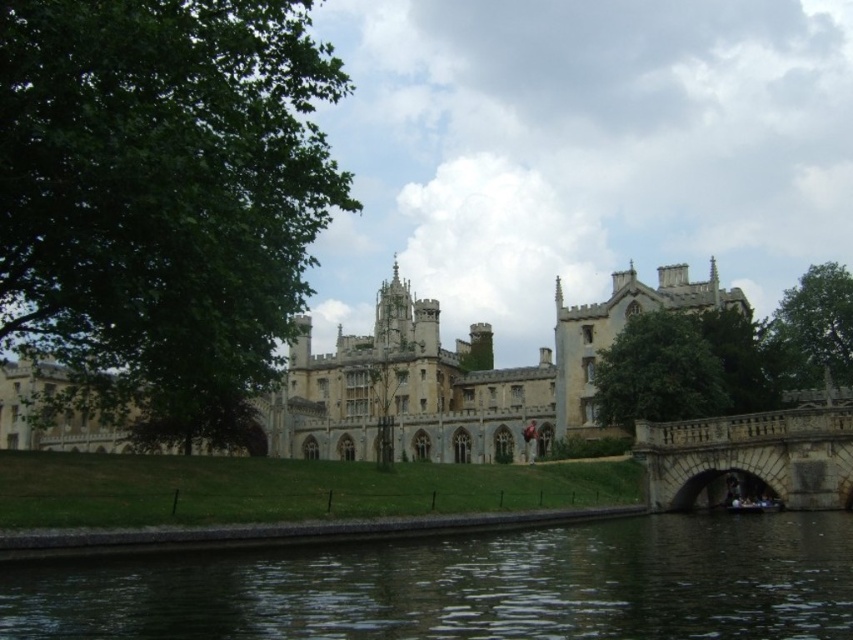
Which is above, green leafy tree at left or green leafy tree at center?

Positioned higher is green leafy tree at left.

Does green leafy tree at left appear under green leafy tree at center?

Actually, green leafy tree at left is above green leafy tree at center.

Does point (126, 51) lie in front of point (610, 408)?

Yes, it is in front of point (610, 408).

Find the location of `green leafy tree at left`. green leafy tree at left is located at coordinates (161, 184).

Between dark green water at lower center and stone castle at center, which one is positioned lower?

dark green water at lower center

Is point (366, 605) closer to viewer compared to point (502, 376)?

Yes, it is in front of point (502, 376).

Does point (796, 525) come in front of point (345, 372)?

Yes, point (796, 525) is in front of point (345, 372).

You are a GUI agent. You are given a task and a screenshot of the screen. Output one action in this format:
    pyautogui.click(x=<x>, y=<y>)
    Task: Click on the dark green water at lower center
    The height and width of the screenshot is (640, 853).
    Given the screenshot: What is the action you would take?
    pyautogui.click(x=466, y=586)

From the picture: Is stone castle at center positioned behind green leafy tree at upper right?

No, stone castle at center is closer to the viewer.

Is stone castle at center above green leafy tree at upper right?

No, stone castle at center is not above green leafy tree at upper right.

Locate an element on the screen. stone castle at center is located at coordinates (457, 376).